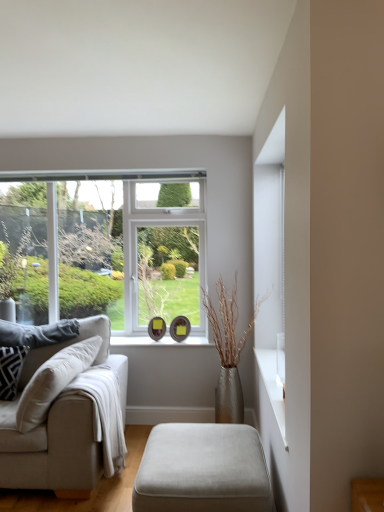
Measure the distance between point (46, 328) and camera.

They are 3.16 meters apart.

What do you see at coordinates (110, 249) in the screenshot?
I see `white plastic window at center` at bounding box center [110, 249].

Locate an element on the screen. suede ottoman at lower center is located at coordinates (202, 470).

Looking at this image, from a real-world perspective, is suede ottoman at lower center physically located above or below gray fabric pillow at left, the 2th pillow in the front-to-back sequence?

From a real-world perspective, suede ottoman at lower center is physically below gray fabric pillow at left, the 2th pillow in the front-to-back sequence.

This screenshot has height=512, width=384. I want to click on table below the gray fabric pillow at left, which is the 1th pillow in back-to-front order (from the image's perspective), so click(x=202, y=470).

How much distance is there between suede ottoman at lower center and gray fabric pillow at left, the 2th pillow in the front-to-back sequence?

suede ottoman at lower center and gray fabric pillow at left, the 2th pillow in the front-to-back sequence, are 1.39 meters apart from each other.

Is suede ottoman at lower center to the left of gray fabric pillow at left, which is the 1th pillow in back-to-front order, from the viewer's perspective?

In fact, suede ottoman at lower center is to the right of gray fabric pillow at left, which is the 1th pillow in back-to-front order.

Where is `the 2nd pillow in front of the white glossy window sill at center, counting from the anchor's position`? the 2nd pillow in front of the white glossy window sill at center, counting from the anchor's position is located at coordinates [11, 370].

Is patterned fabric pillow on the left, which is the second pillow from back to front, situated inside white glossy window sill at center or outside?

The correct answer is: outside.

Is white glossy window sill at center at the back of patterned fabric pillow on the left, which is the second pillow from back to front?

No, white glossy window sill at center is not at the back of patterned fabric pillow on the left, which is the second pillow from back to front.

Could you tell me if patterned fabric pillow on the left, the first pillow viewed from the front, is turned towards gray fabric pillow at left, the 2th pillow in the front-to-back sequence?

No, patterned fabric pillow on the left, the first pillow viewed from the front, is not aimed at gray fabric pillow at left, the 2th pillow in the front-to-back sequence.

From a real-world perspective, is patterned fabric pillow on the left, the first pillow viewed from the front, positioned over gray fabric pillow at left, which is the 1th pillow in back-to-front order, based on gravity?

No.

In the image, there is a patterned fabric pillow on the left, which is the second pillow from back to front. In order to click on pillow above it (from the image's perspective) in this screenshot , I will do `click(37, 333)`.

Is patterned fabric pillow on the left, the first pillow viewed from the front, beside gray fabric pillow at left, which is the 1th pillow in back-to-front order?

patterned fabric pillow on the left, the first pillow viewed from the front, is not next to gray fabric pillow at left, which is the 1th pillow in back-to-front order, and they're not touching.

Which of these two, white glossy window sill at center or patterned fabric pillow on the left, the first pillow viewed from the front, is thinner?

With smaller width is patterned fabric pillow on the left, the first pillow viewed from the front.

Is white glossy window sill at center completely or partially outside of patterned fabric pillow on the left, which is the second pillow from back to front?

Yes, white glossy window sill at center is not within patterned fabric pillow on the left, which is the second pillow from back to front.

From the image's perspective, which is below, white glossy window sill at center or patterned fabric pillow on the left, the first pillow viewed from the front?

From the image's view, patterned fabric pillow on the left, the first pillow viewed from the front, is below.

Considering the relative sizes of white glossy window sill at center and suede ottoman at lower center in the image provided, is white glossy window sill at center shorter than suede ottoman at lower center?

Yes, white glossy window sill at center is shorter than suede ottoman at lower center.

In the scene shown: Considering the relative positions of white glossy window sill at center and suede ottoman at lower center in the image provided, is white glossy window sill at center to the right of suede ottoman at lower center from the viewer's perspective?

No, white glossy window sill at center is not to the right of suede ottoman at lower center.

Considering the sizes of objects white glossy window sill at center and suede ottoman at lower center in the image provided, who is smaller, white glossy window sill at center or suede ottoman at lower center?

white glossy window sill at center.

How many degrees apart are the facing directions of white glossy window sill at center and suede ottoman at lower center?

The facing directions of white glossy window sill at center and suede ottoman at lower center are 89.2 degrees apart.

Would you say white glossy window sill at center is outside white plastic window at center?

Yes, white glossy window sill at center is located beyond the bounds of white plastic window at center.

From the image's perspective, is white glossy window sill at center located beneath white plastic window at center?

Yes, from the image's perspective, white glossy window sill at center is below white plastic window at center.

Can you confirm if white glossy window sill at center is positioned to the right of white plastic window at center?

Indeed, white glossy window sill at center is positioned on the right side of white plastic window at center.

Is white glossy window sill at center closer to camera compared to white plastic window at center?

Yes, it is.

What's the angular difference between white plastic window at center and beige fabric couch at left's facing directions?

They differ by 0.372 degrees in their facing directions.

How far apart are white plastic window at center and beige fabric couch at left?

The distance of white plastic window at center from beige fabric couch at left is 3.31 feet.

Between white plastic window at center and beige fabric couch at left, which one is positioned behind?

white plastic window at center is more distant.

Considering the relative sizes of white plastic window at center and beige fabric couch at left in the image provided, is white plastic window at center taller than beige fabric couch at left?

Indeed, white plastic window at center has a greater height compared to beige fabric couch at left.

The height and width of the screenshot is (512, 384). Identify the location of table below the gray fabric pillow at left, which is the 1th pillow in back-to-front order (from the image's perspective). (202, 470).

From the white glossy window sill at center, count 2nd pillows forward and point to it. Please provide its 2D coordinates.

[(11, 370)]

Estimate the real-world distances between objects in this image. Which object is further from beige fabric couch at left, suede ottoman at lower center or white plastic window at center?

The object further to beige fabric couch at left is white plastic window at center.

Based on their spatial positions, is gray fabric pillow at left, the 2th pillow in the front-to-back sequence, or beige fabric couch at left further from suede ottoman at lower center?

gray fabric pillow at left, the 2th pillow in the front-to-back sequence, is positioned further to the anchor suede ottoman at lower center.

Which object lies nearer to the anchor point white plastic window at center, white glossy window sill at center or patterned fabric pillow on the left, the first pillow viewed from the front?

white glossy window sill at center is positioned closer to the anchor white plastic window at center.

Estimate the real-world distances between objects in this image. Which object is closer to suede ottoman at lower center, patterned fabric pillow on the left, the first pillow viewed from the front, or gray fabric pillow at left, which is the 1th pillow in back-to-front order?

gray fabric pillow at left, which is the 1th pillow in back-to-front order.

Considering their positions, is white glossy window sill at center positioned further to gray fabric pillow at left, the 2th pillow in the front-to-back sequence, than patterned fabric pillow on the left, the first pillow viewed from the front?

white glossy window sill at center lies further to gray fabric pillow at left, the 2th pillow in the front-to-back sequence, than the other object.

Which object lies further to the anchor point suede ottoman at lower center, white glossy window sill at center or beige fabric couch at left?

white glossy window sill at center is positioned further to the anchor suede ottoman at lower center.

From the image, which object appears to be nearer to patterned fabric pillow on the left, which is the second pillow from back to front, white glossy window sill at center or suede ottoman at lower center?

The object closer to patterned fabric pillow on the left, which is the second pillow from back to front, is white glossy window sill at center.

Consider the image. Estimate the real-world distances between objects in this image. Which object is further from beige fabric couch at left, white plastic window at center or gray fabric pillow at left, the 2th pillow in the front-to-back sequence?

The object further to beige fabric couch at left is white plastic window at center.

In order to click on pillow located between patterned fabric pillow on the left, which is the second pillow from back to front, and suede ottoman at lower center in the left-right direction in this screenshot , I will do `click(37, 333)`.

You are a GUI agent. You are given a task and a screenshot of the screen. Output one action in this format:
    pyautogui.click(x=<x>, y=<y>)
    Task: Click on the window between patterned fabric pillow on the left, the first pillow viewed from the front, and white glossy window sill at center from left to right
    
    Given the screenshot: What is the action you would take?
    click(x=110, y=249)

Find the location of a particular element. The width and height of the screenshot is (384, 512). studio couch between suede ottoman at lower center and white plastic window at center in the front-back direction is located at coordinates (65, 415).

Image resolution: width=384 pixels, height=512 pixels. I want to click on pillow positioned between beige fabric couch at left and gray fabric pillow at left, which is the 1th pillow in back-to-front order, from near to far, so click(11, 370).